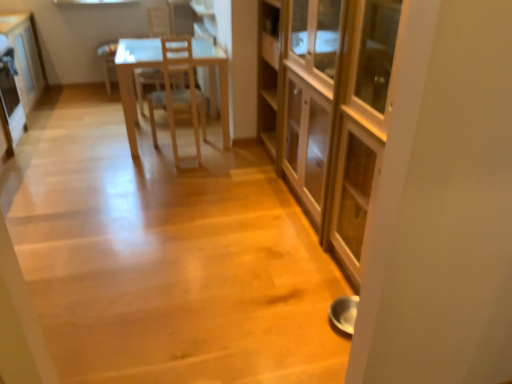
This screenshot has height=384, width=512. Find the location of `vacant space to the right of wooden chair at center`. vacant space to the right of wooden chair at center is located at coordinates (229, 155).